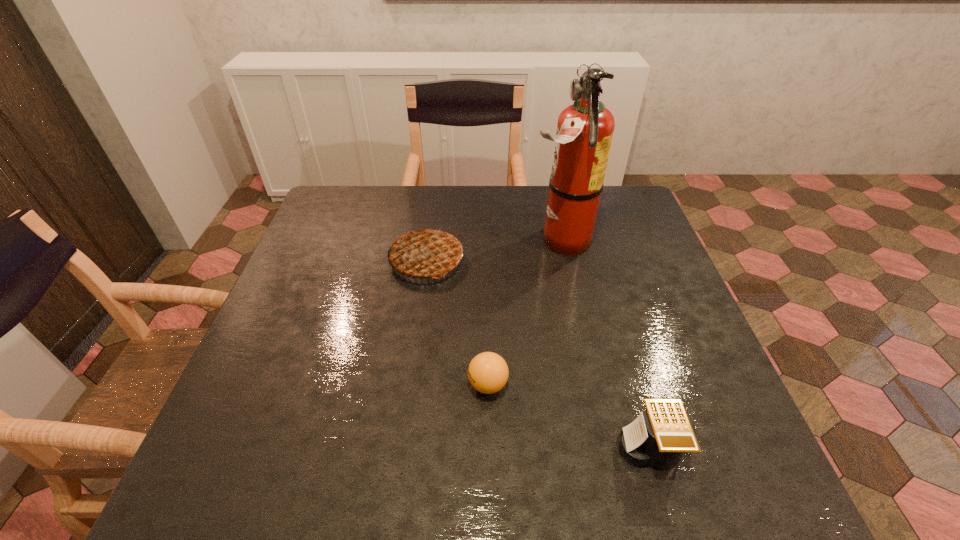
The width and height of the screenshot is (960, 540). In order to click on free spot located on the back of the nearest object in this screenshot , I will do pyautogui.click(x=612, y=322).

Identify the location of vacant area situated 0.260m on the side with brand of the second nearest object. The image size is (960, 540). (345, 384).

In order to click on blank space located on the side with brand of the second nearest object in this screenshot , I will do `click(373, 384)`.

Identify the location of free point located 0.380m on the side with brand of the second nearest object. Image resolution: width=960 pixels, height=540 pixels. (288, 384).

Locate an element on the screen. object present at the far edge is located at coordinates (585, 129).

Find the location of a particular element. Image resolution: width=960 pixels, height=540 pixels. object located at the near edge is located at coordinates (659, 439).

Find the location of a particular element. The width and height of the screenshot is (960, 540). object that is at the right edge is located at coordinates (659, 439).

Where is `object that is at the near right corner`? The width and height of the screenshot is (960, 540). object that is at the near right corner is located at coordinates (659, 439).

Locate an element on the screen. blank space at the far edge of the desktop is located at coordinates (450, 191).

Find the location of `vacant space at the near edge of the desktop`. vacant space at the near edge of the desktop is located at coordinates (365, 480).